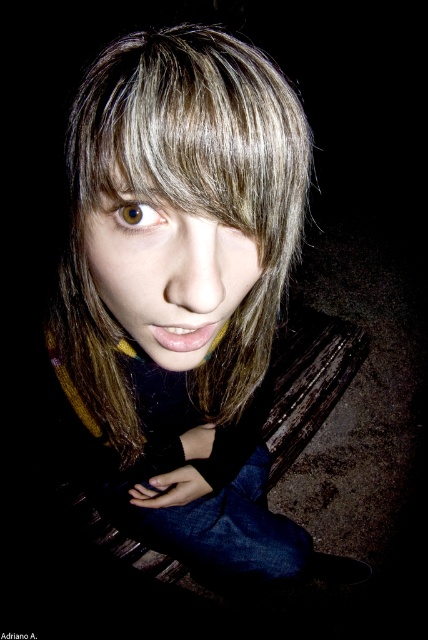
You are a photographer adjusting lighting for a portrait. The subject has smooth brown hair at center and smooth skin face at center. Since the hair is taller than the face, how might you adjust the lighting to ensure both features are well illuminated?

The smooth brown hair at center has a greater height compared to the smooth skin face at center. To ensure both are well illuminated, position the light source slightly above and behind the subject to cast even lighting on the taller hair while still illuminating the face adequately.